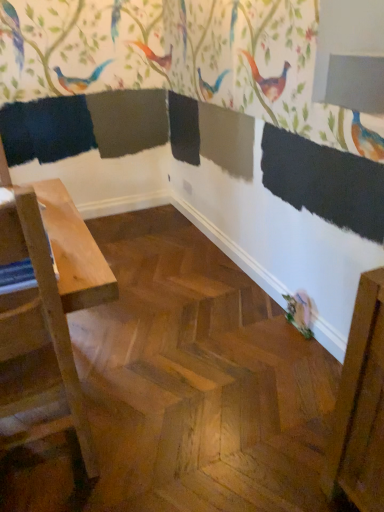
What do you see at coordinates (299, 312) in the screenshot? I see `matte pink bird at lower right` at bounding box center [299, 312].

Find the location of `matte pink bird at lower right`. matte pink bird at lower right is located at coordinates (299, 312).

What is the approximate height of matte pink bird at lower right?

It is 8.53 inches.

Measure the distance between point (0, 212) and camera.

They are 35.31 inches apart.

This screenshot has width=384, height=512. Describe the element at coordinates (48, 308) in the screenshot. I see `light wood table at left` at that location.

Measure the distance between light wood table at left and camera.

They are 35.51 inches apart.

This screenshot has width=384, height=512. What are the coordinates of `light wood table at left` in the screenshot? It's located at (48, 308).

The height and width of the screenshot is (512, 384). I want to click on matte pink bird at lower right, so click(299, 312).

Based on their positions, is light wood table at left located to the left or right of matte pink bird at lower right?

From the image, it's evident that light wood table at left is to the left of matte pink bird at lower right.

Which object is further away from the camera taking this photo, light wood table at left or matte pink bird at lower right?

matte pink bird at lower right is further from the camera.

Between point (34, 330) and point (308, 298), which one is positioned behind?

Positioned behind is point (308, 298).

From the image's perspective, does light wood table at left appear higher than matte pink bird at lower right?

Yes.

From a real-world perspective, is light wood table at left positioned above or below matte pink bird at lower right?

In terms of real-world spatial position, light wood table at left is above matte pink bird at lower right.

Considering the relative sizes of light wood table at left and matte pink bird at lower right in the image provided, is light wood table at left thinner than matte pink bird at lower right?

No.

Who is shorter, light wood table at left or matte pink bird at lower right?

Standing shorter between the two is matte pink bird at lower right.

Does light wood table at left have a smaller size compared to matte pink bird at lower right?

Actually, light wood table at left might be larger than matte pink bird at lower right.

Which is correct: light wood table at left is inside matte pink bird at lower right, or outside of it?

light wood table at left is spatially situated outside matte pink bird at lower right.

Is light wood table at left next to matte pink bird at lower right?

light wood table at left and matte pink bird at lower right are clearly separated.

Is light wood table at left facing towards matte pink bird at lower right?

No, light wood table at left is not aimed at matte pink bird at lower right.

How many degrees apart are the facing directions of light wood table at left and matte pink bird at lower right?

They differ by 88.4 degrees in their facing directions.

How much distance is there between light wood table at left and matte pink bird at lower right?

light wood table at left and matte pink bird at lower right are 4.14 feet apart from each other.

The image size is (384, 512). Find the location of `table lying in front of the matte pink bird at lower right`. table lying in front of the matte pink bird at lower right is located at coordinates (48, 308).

Considering the relative positions of matte pink bird at lower right and light wood table at left in the image provided, is matte pink bird at lower right to the right of light wood table at left from the viewer's perspective?

Correct, you'll find matte pink bird at lower right to the right of light wood table at left.

Which object is closer to the camera, matte pink bird at lower right or light wood table at left?

light wood table at left.

Is point (304, 333) farther from viewer compared to point (83, 271)?

That is True.

From the image's perspective, is matte pink bird at lower right positioned above or below light wood table at left?

matte pink bird at lower right is below light wood table at left.

From a real-world perspective, which is physically below, matte pink bird at lower right or light wood table at left?

From a 3D spatial view, matte pink bird at lower right is below.

Between matte pink bird at lower right and light wood table at left, which one has larger width?

light wood table at left is wider.

Considering the relative sizes of matte pink bird at lower right and light wood table at left in the image provided, is matte pink bird at lower right shorter than light wood table at left?

Yes.

Can you confirm if matte pink bird at lower right is bigger than light wood table at left?

No.

Looking at this image, is light wood table at left surrounded by matte pink bird at lower right?

That's incorrect, light wood table at left is not inside matte pink bird at lower right.

Is matte pink bird at lower right next to light wood table at left?

No, matte pink bird at lower right is not beside light wood table at left.

Is light wood table at left at the back of matte pink bird at lower right?

That's not correct — matte pink bird at lower right is not looking away from light wood table at left.

What's the angular difference between matte pink bird at lower right and light wood table at left's facing directions?

The angular difference between matte pink bird at lower right and light wood table at left is 88.4 degrees.

Identify the location of table that appears on the left of matte pink bird at lower right. (48, 308).

In order to click on table to the left of matte pink bird at lower right in this screenshot , I will do `click(48, 308)`.

What are the coordinates of `table that appears in front of the matte pink bird at lower right` in the screenshot? It's located at (48, 308).